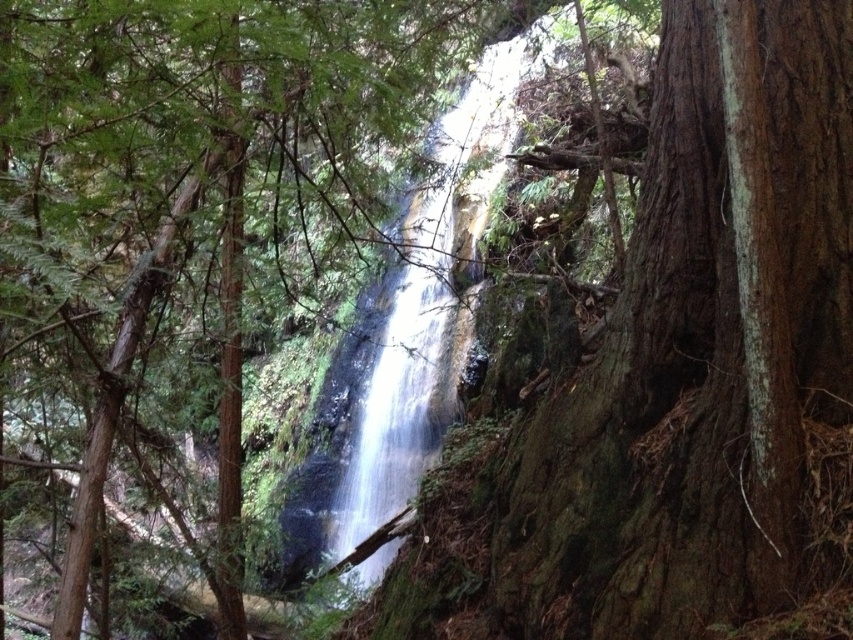
Can you confirm if white smooth waterfall at center is positioned to the left of green rough bark tree at center?

No, white smooth waterfall at center is not to the left of green rough bark tree at center.

Who is lower down, white smooth waterfall at center or green rough bark tree at center?

green rough bark tree at center is lower down.

The image size is (853, 640). What are the coordinates of `white smooth waterfall at center` in the screenshot? It's located at (428, 307).